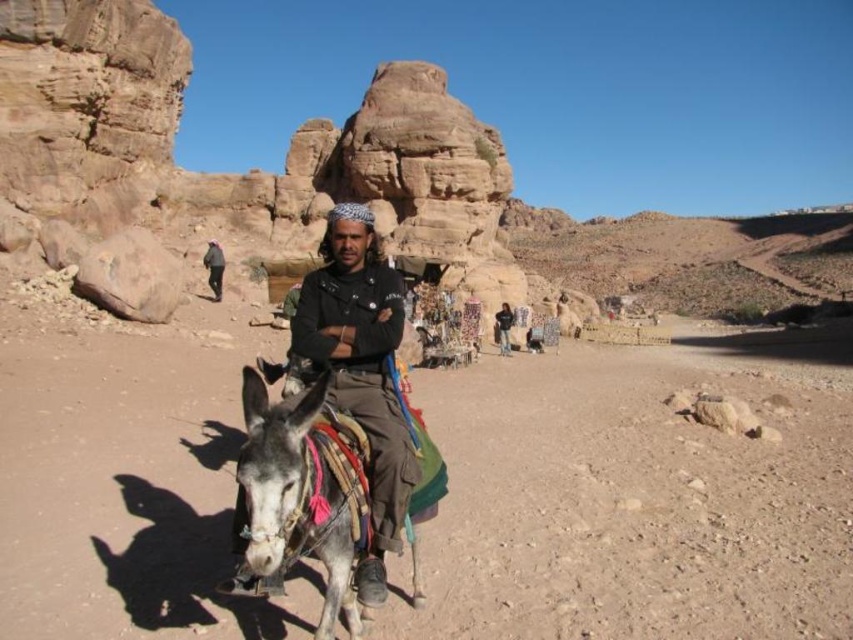
Question: Which object appears closest to the camera in this image?

Choices:
 (A) dark blue fabric at center
 (B) gray textured donkey at center

Answer: (B)

Question: Which point is farther to the camera?

Choices:
 (A) (285, 440)
 (B) (219, 289)

Answer: (B)

Question: Where is gray textured donkey at center located in relation to black matte shirt at center in the image?

Choices:
 (A) left
 (B) right

Answer: (B)

Question: Observing the image, what is the correct spatial positioning of gray textured donkey at center in reference to dark blue fabric at center?

Choices:
 (A) left
 (B) right

Answer: (A)

Question: Does gray textured donkey at center have a larger size compared to dark blue fabric at center?

Choices:
 (A) yes
 (B) no

Answer: (A)

Question: Considering the real-world distances, which object is closest to the dark brown leather jacket at center?

Choices:
 (A) dark blue fabric at center
 (B) black matte shirt at center

Answer: (A)